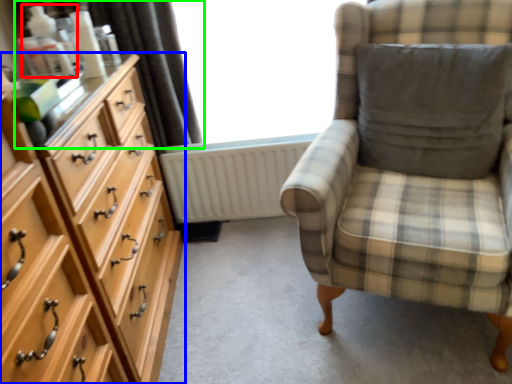
Question: Which object is positioned farthest from toiletry (highlighted by a red box)? Select from chest of drawers (highlighted by a blue box) and curtain (highlighted by a green box).

Choices:
 (A) chest of drawers
 (B) curtain

Answer: (A)